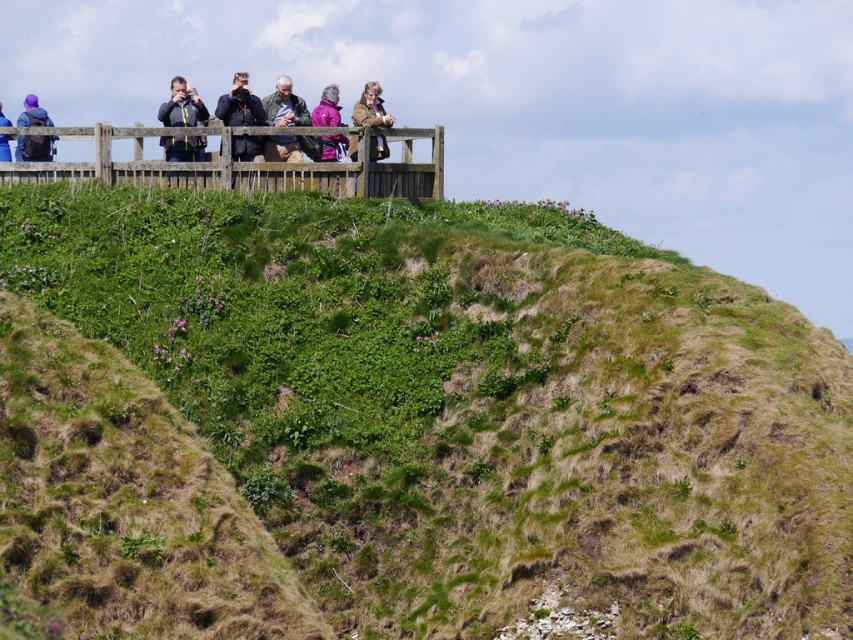
Is point (329, 138) in front of point (3, 125)?

Yes, point (329, 138) is in front of point (3, 125).

Describe the element at coordinates (328, 108) in the screenshot. I see `pink fabric jacket at upper center` at that location.

Image resolution: width=853 pixels, height=640 pixels. I want to click on pink fabric jacket at upper center, so click(x=328, y=108).

Between point (386, 148) and point (9, 154), which one is positioned in front?

Point (386, 148)

How distant is brown leather jacket at upper center from matte blue jacket at upper left?

They are 44.75 feet apart.

You are a GUI agent. You are given a task and a screenshot of the screen. Output one action in this format:
    pyautogui.click(x=<x>, y=<y>)
    Task: Click on the brown leather jacket at upper center
    
    Given the screenshot: What is the action you would take?
    pyautogui.click(x=370, y=108)

You are a GUI agent. You are given a task and a screenshot of the screen. Output one action in this format:
    pyautogui.click(x=<x>, y=<y>)
    Task: Click on the brown leather jacket at upper center
    The height and width of the screenshot is (640, 853).
    Given the screenshot: What is the action you would take?
    pyautogui.click(x=370, y=108)

Can you confirm if matte gray jacket at center is smaller than brown leather jacket at upper center?

No.

Consider the image. Who is more forward, (265, 115) or (352, 138)?

Positioned in front is point (352, 138).

This screenshot has width=853, height=640. Find the location of `matte gray jacket at center`. matte gray jacket at center is located at coordinates (283, 106).